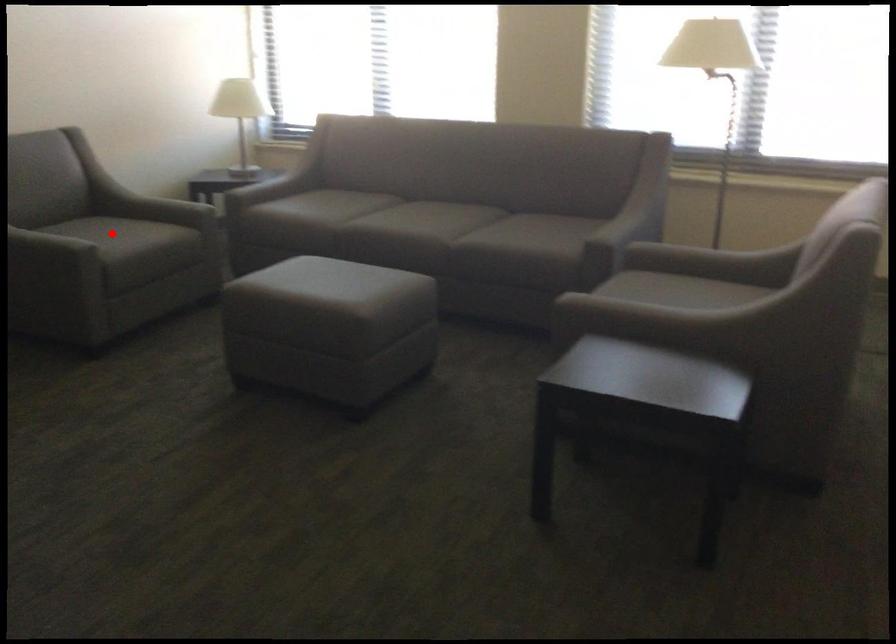
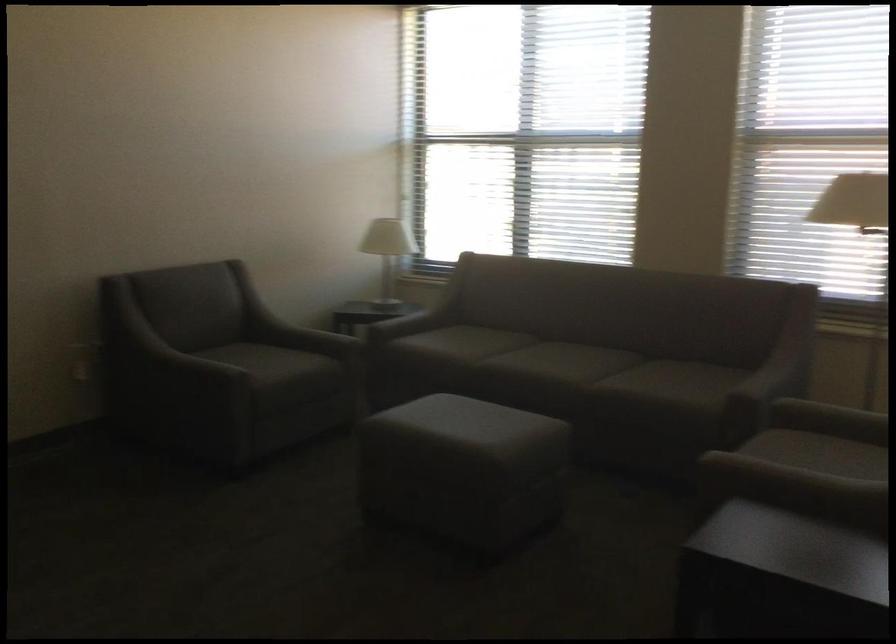
The point at the highlighted location is marked in the first image. Where is the corresponding point in the second image?

(259, 359)